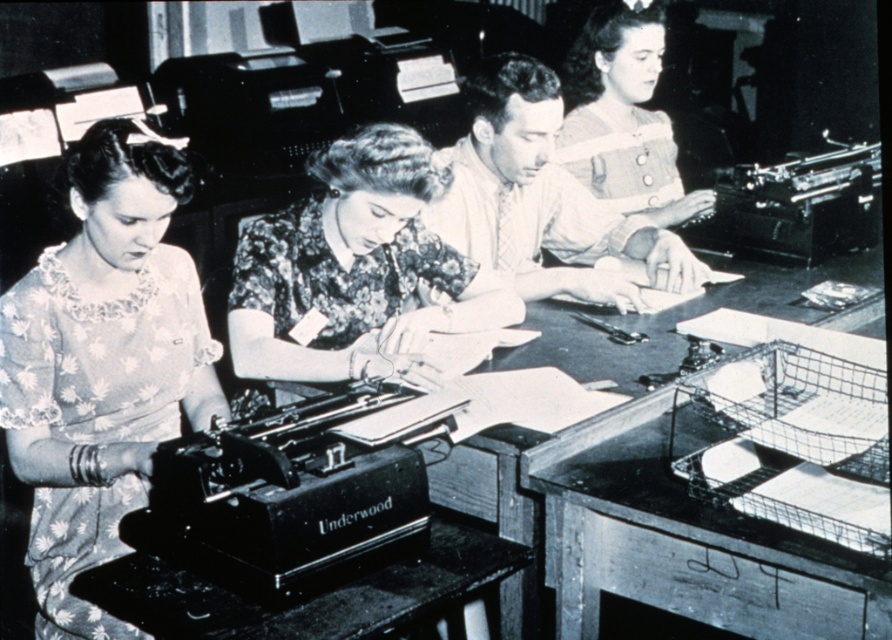
In the vintage office scene, there are four people seated at a long wooden desk, each using an Underwood typewriter. You notice the floral lace blouse at left and the other three typists. From the perspective of someone standing at the entrance of the office, which typist is closest to the left side of the desk?

The typist wearing the floral lace blouse at left is closest to the left side of the desk because their position is at point (102, 364), which places them on the leftmost end of the desk from the entrance perspective.

In the vintage office scene, there are two items of interest. You see a floral lace blouse at left and a metallic black typewriter at lower left. From the perspective of someone standing at the front of the desk, which item is positioned to the right?

The metallic black typewriter at lower left is to the right of the floral lace blouse at left.

You are organizing a vintage clothing exhibit and need to display the floral lace blouse at left and the matte brown blouse at center. Since the display case has limited space, which blouse should you choose to fit better in a narrow compartment?

The floral lace blouse at left has a lesser width compared to the matte brown blouse at center, so it would fit better in a narrow compartment.